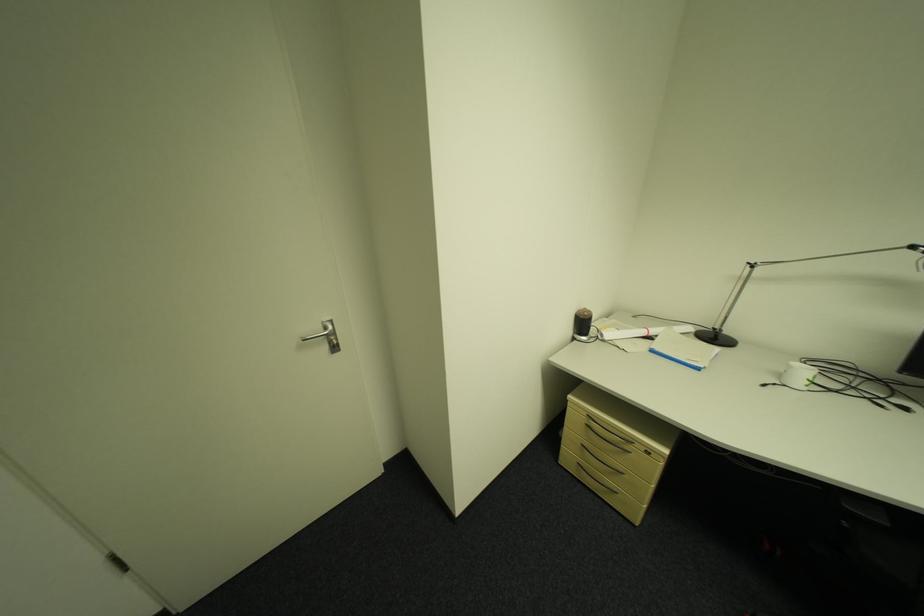
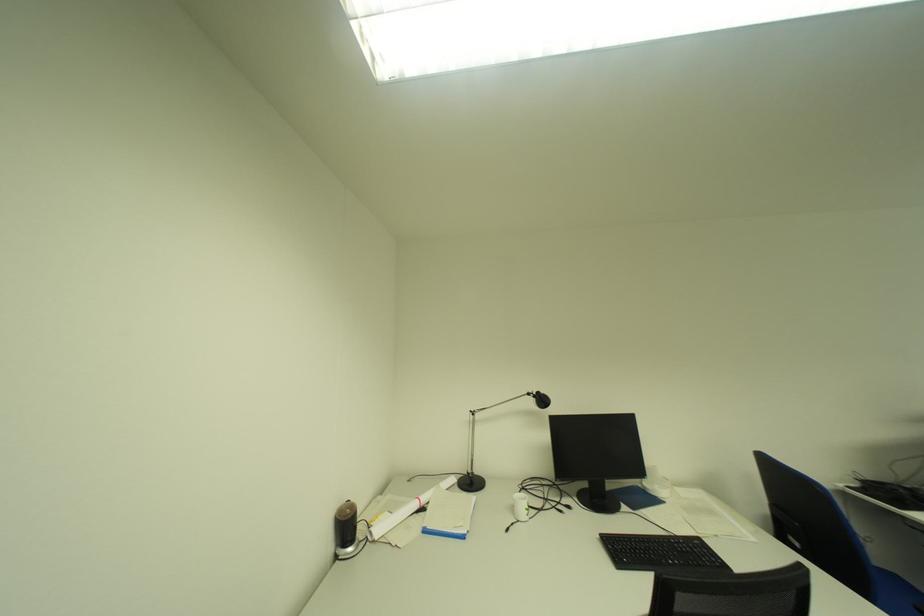
How did the camera likely rotate?

The camera's rotation is toward right-up.